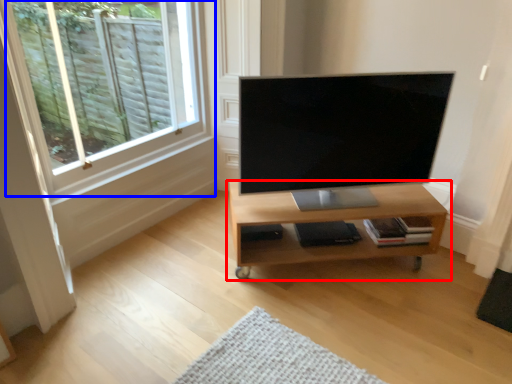
Question: Which of the following is the closest to the observer, shelf (highlighted by a red box) or window (highlighted by a blue box)?

Choices:
 (A) shelf
 (B) window

Answer: (B)